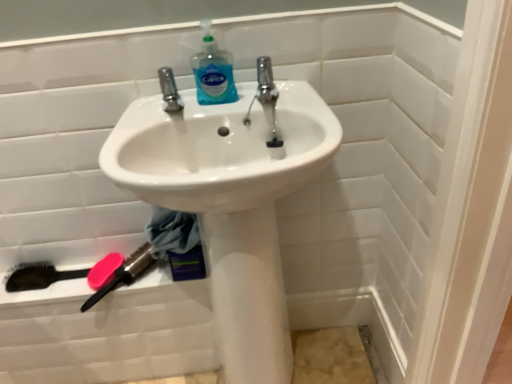
Question: Can you confirm if blue translucent liquid at upper center is shorter than black bristle brush at lower left, placed as the 2th brush when sorted from right to left?

Choices:
 (A) yes
 (B) no

Answer: (B)

Question: From the image's perspective, is blue translucent liquid at upper center under black bristle brush at lower left, placed as the 1th brush when sorted from left to right?

Choices:
 (A) no
 (B) yes

Answer: (A)

Question: Does blue translucent liquid at upper center lie behind black bristle brush at lower left, placed as the 1th brush when sorted from left to right?

Choices:
 (A) yes
 (B) no

Answer: (B)

Question: Is blue translucent liquid at upper center not near black bristle brush at lower left, placed as the 1th brush when sorted from left to right?

Choices:
 (A) no
 (B) yes

Answer: (A)

Question: Is blue translucent liquid at upper center touching black bristle brush at lower left, placed as the 2th brush when sorted from right to left?

Choices:
 (A) no
 (B) yes

Answer: (A)

Question: Is pink rubber soap at lower left to the left or to the right of blue translucent liquid at upper center in the image?

Choices:
 (A) right
 (B) left

Answer: (B)

Question: Is pink rubber soap at lower left wider or thinner than blue translucent liquid at upper center?

Choices:
 (A) thin
 (B) wide

Answer: (B)

Question: From a real-world perspective, is pink rubber soap at lower left physically located above or below blue translucent liquid at upper center?

Choices:
 (A) below
 (B) above

Answer: (A)

Question: In terms of size, does pink rubber soap at lower left appear bigger or smaller than blue translucent liquid at upper center?

Choices:
 (A) big
 (B) small

Answer: (B)

Question: Is point (198, 61) positioned closer to the camera than point (245, 256)?

Choices:
 (A) farther
 (B) closer

Answer: (A)

Question: From a real-world perspective, is blue translucent liquid at upper center above or below white glossy sink at center?

Choices:
 (A) above
 (B) below

Answer: (A)

Question: Considering the positions of blue translucent liquid at upper center and white glossy sink at center in the image, is blue translucent liquid at upper center taller or shorter than white glossy sink at center?

Choices:
 (A) tall
 (B) short

Answer: (B)

Question: From the image's perspective, is blue translucent liquid at upper center above or below white glossy sink at center?

Choices:
 (A) below
 (B) above

Answer: (B)

Question: Looking at the image, does polished chrome tap at center seem bigger or smaller compared to pink plastic brush at lower left, the first brush when ordered from right to left?

Choices:
 (A) small
 (B) big

Answer: (A)

Question: In terms of height, does polished chrome tap at center look taller or shorter compared to pink plastic brush at lower left, the first brush when ordered from right to left?

Choices:
 (A) tall
 (B) short

Answer: (A)